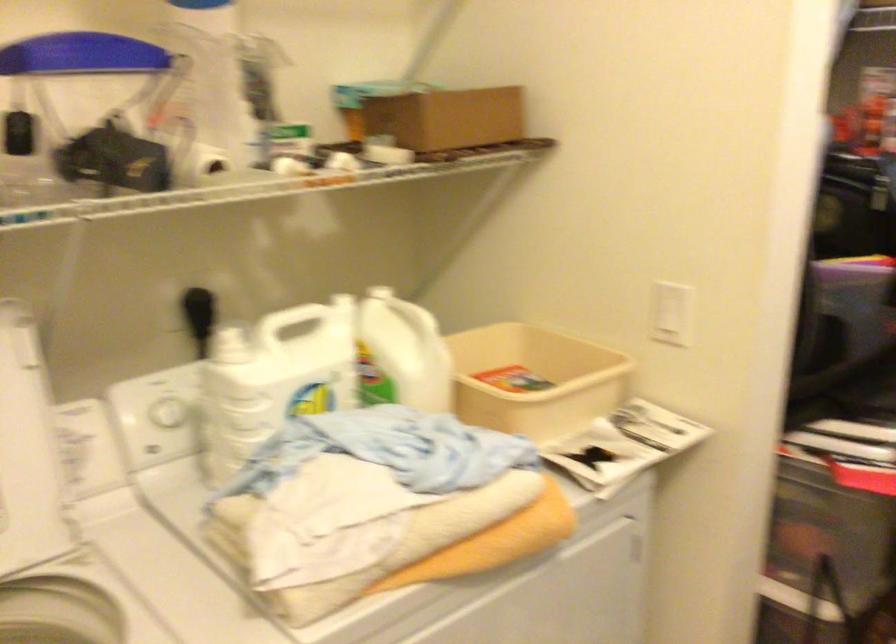
Find where to twist the white bottle cap. Please return your answer as a coordinate pair (x, y).

(211, 162)